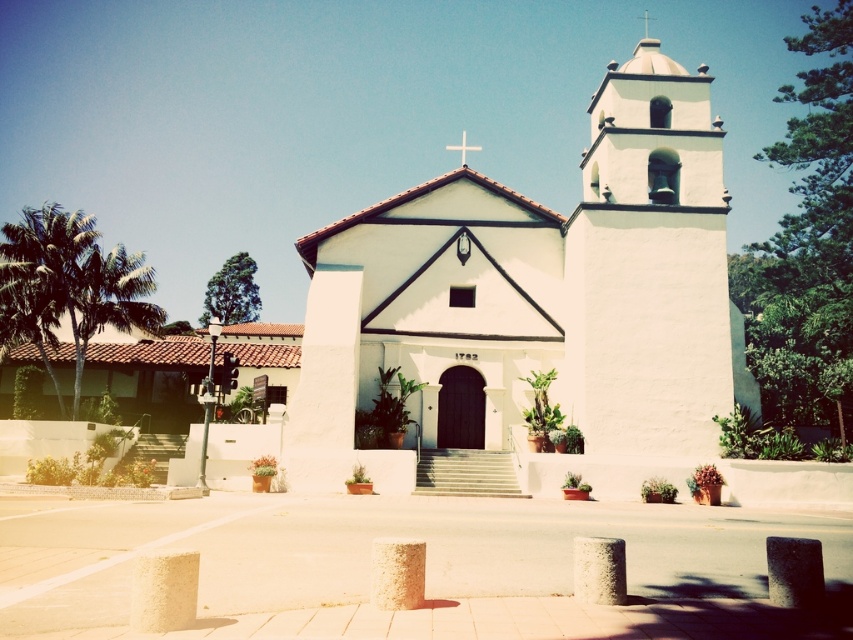
Is white stucco chapel at center thinner than white cross at center?

Incorrect, white stucco chapel at center's width is not less than white cross at center's.

The image size is (853, 640). Identify the location of white stucco chapel at center. (541, 300).